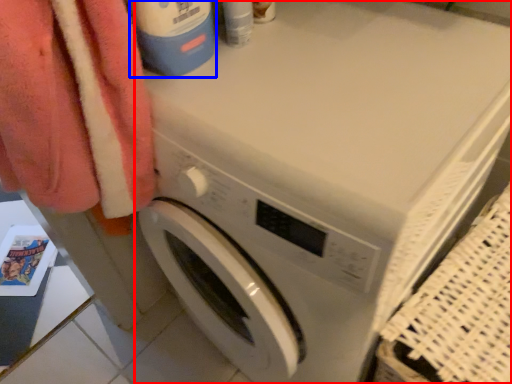
Question: Which object appears closest to the camera in this image, washing machine (highlighted by a red box) or cleaning product (highlighted by a blue box)?

Choices:
 (A) washing machine
 (B) cleaning product

Answer: (A)